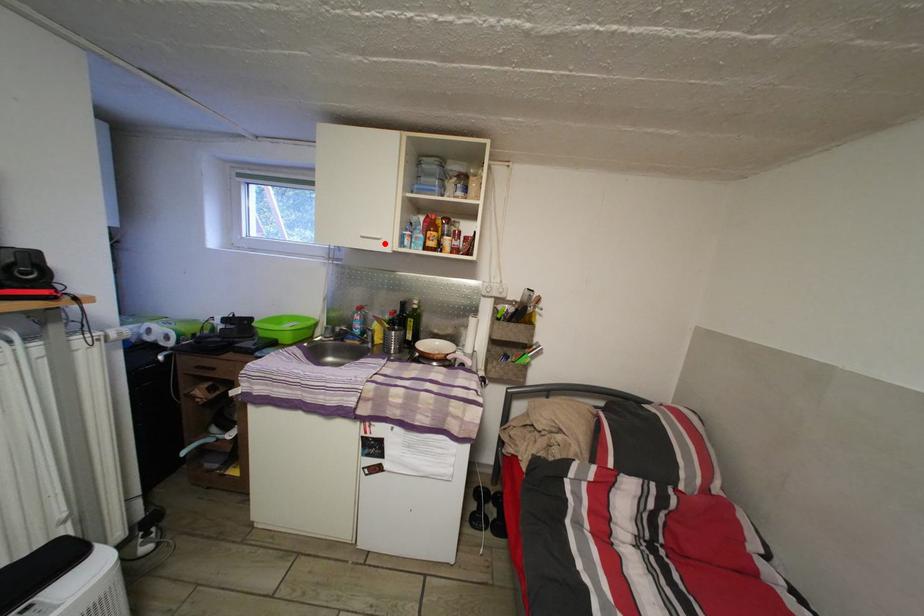
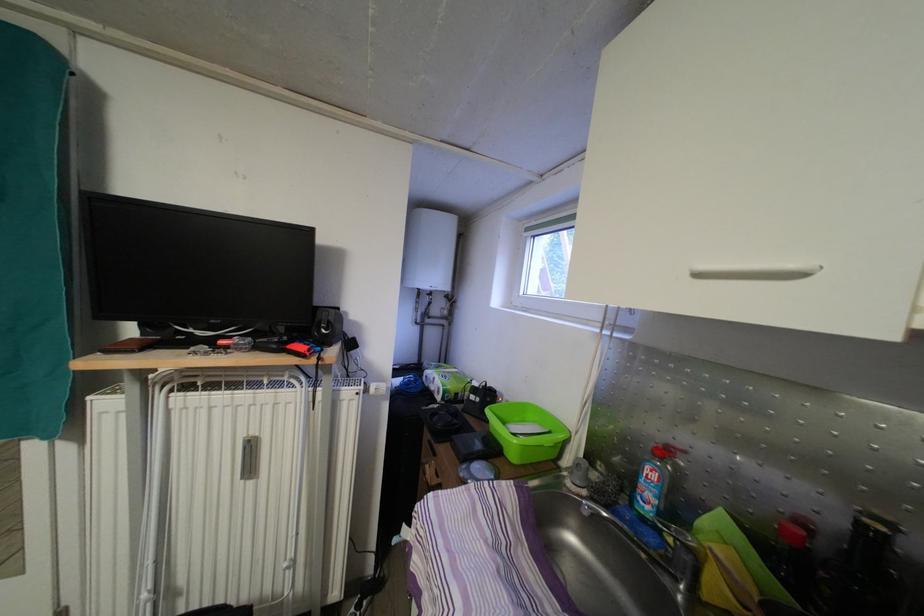
In the second image, find the point that corresponds to the highlighted location in the first image.

(800, 272)